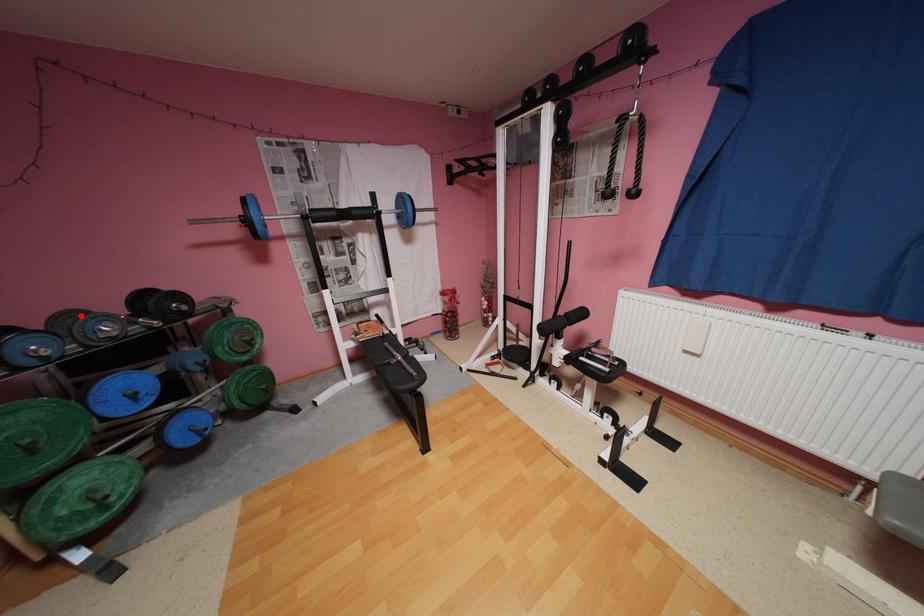
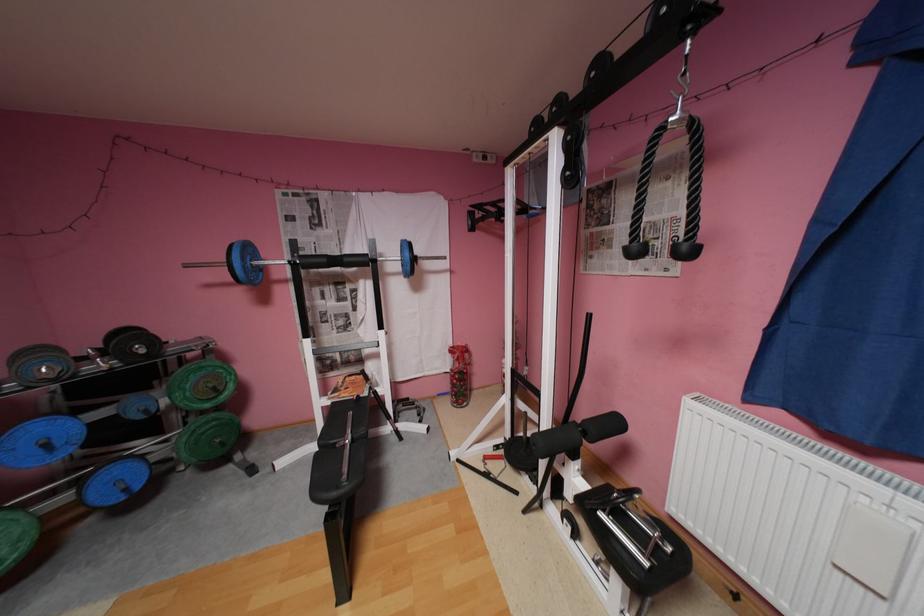
Find the pixel in the second image that matches the highlighted location in the first image.

(49, 351)